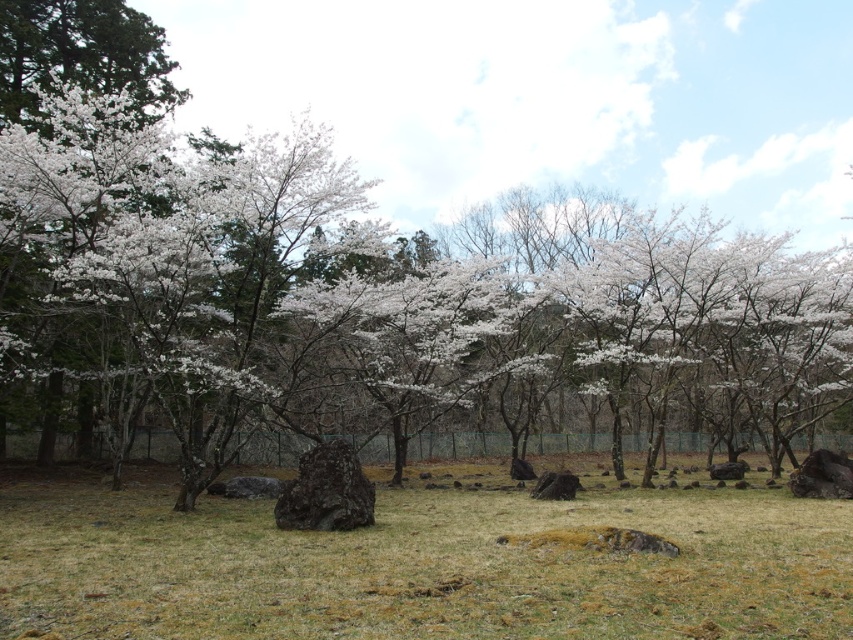
Between brown grass at center and white blossoms at center, which one is positioned higher?

white blossoms at center is above.

Can you confirm if brown grass at center is taller than white blossoms at center?

No, brown grass at center is not taller than white blossoms at center.

Is point (502, 577) more distant than point (16, 301)?

No.

The height and width of the screenshot is (640, 853). Find the location of `brown grass at center`. brown grass at center is located at coordinates (418, 564).